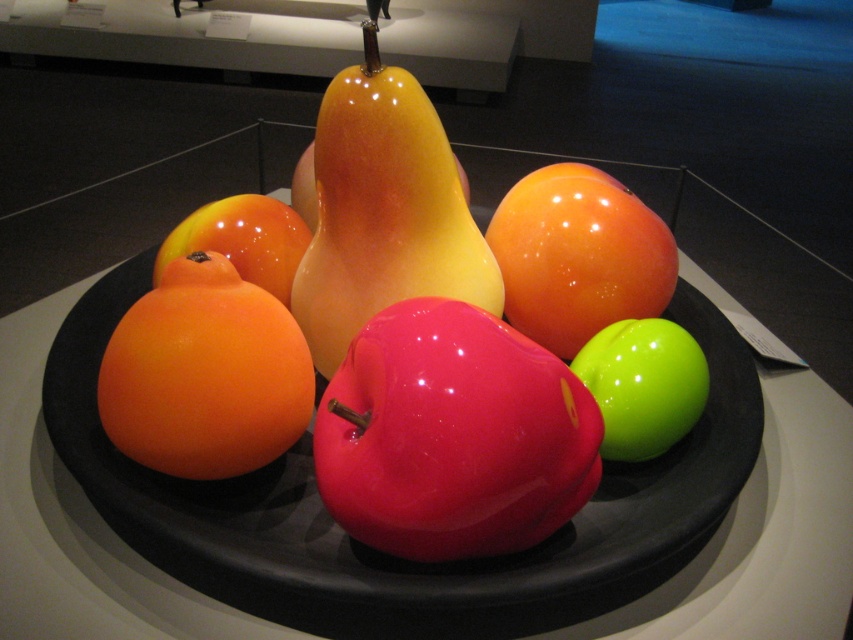
Question: Can you confirm if glossy orange at center is wider than glossy neon green apple at center?

Choices:
 (A) no
 (B) yes

Answer: (B)

Question: From the image, what is the correct spatial relationship of glossy ceramic plate at center in relation to glossy yellow pear at center?

Choices:
 (A) left
 (B) right

Answer: (A)

Question: Which object is the closest to the glossy orange at center?

Choices:
 (A) glossy ceramic plate at center
 (B) glossy yellow pear at center

Answer: (A)

Question: Which of the following is the closest to the observer?

Choices:
 (A) (55, 412)
 (B) (325, 141)

Answer: (B)

Question: Is glossy yellow pear at center bigger than glossy orange at center?

Choices:
 (A) yes
 (B) no

Answer: (A)

Question: Which point is farther from the camera taking this photo?

Choices:
 (A) (374, 84)
 (B) (477, 310)
 (C) (115, 396)

Answer: (A)